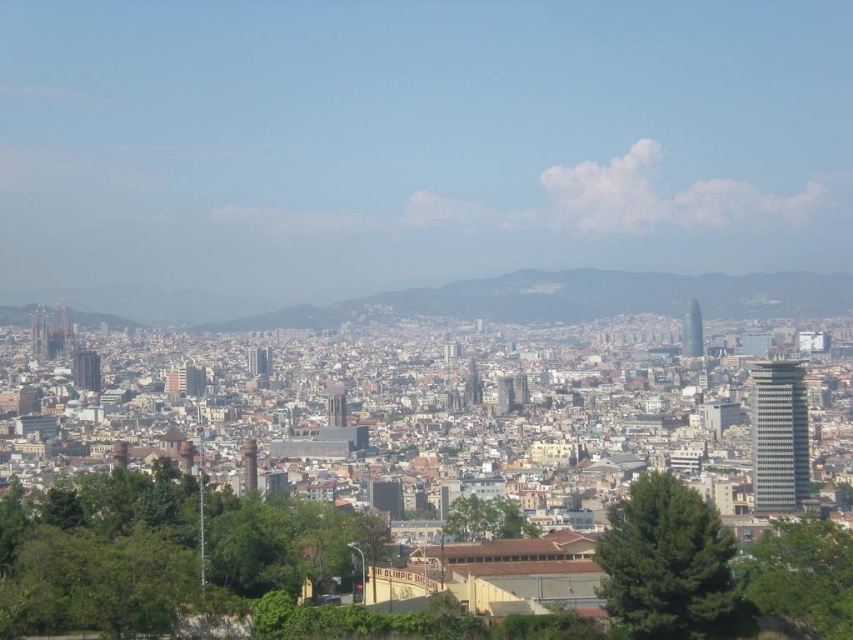
Which of these two, green leafy tree at lower left or green textured tree at center, stands shorter?

Standing shorter between the two is green leafy tree at lower left.

Based on the photo, can you confirm if green leafy tree at lower left is smaller than green textured tree at center?

Actually, green leafy tree at lower left might be larger than green textured tree at center.

At what (x,y) coordinates should I click in order to perform the action: click on green leafy tree at lower left. Please return your answer as a coordinate pair (x, y). Looking at the image, I should click on (158, 552).

Is green textured tree at center further to the viewer compared to green leafy tree at lower right?

That is False.

Between green textured tree at center and green leafy tree at lower right, which one is positioned lower?

Positioned lower is green leafy tree at lower right.

Does point (622, 524) come in front of point (784, 520)?

Yes, it is.

Where is `green textured tree at center`? The height and width of the screenshot is (640, 853). green textured tree at center is located at coordinates (666, 563).

Can you confirm if green leafy tree at lower left is positioned above green leafy tree at lower right?

Indeed, green leafy tree at lower left is positioned over green leafy tree at lower right.

Is point (129, 483) closer to viewer compared to point (850, 576)?

Yes, point (129, 483) is closer to viewer.

Image resolution: width=853 pixels, height=640 pixels. I want to click on green leafy tree at lower left, so click(x=158, y=552).